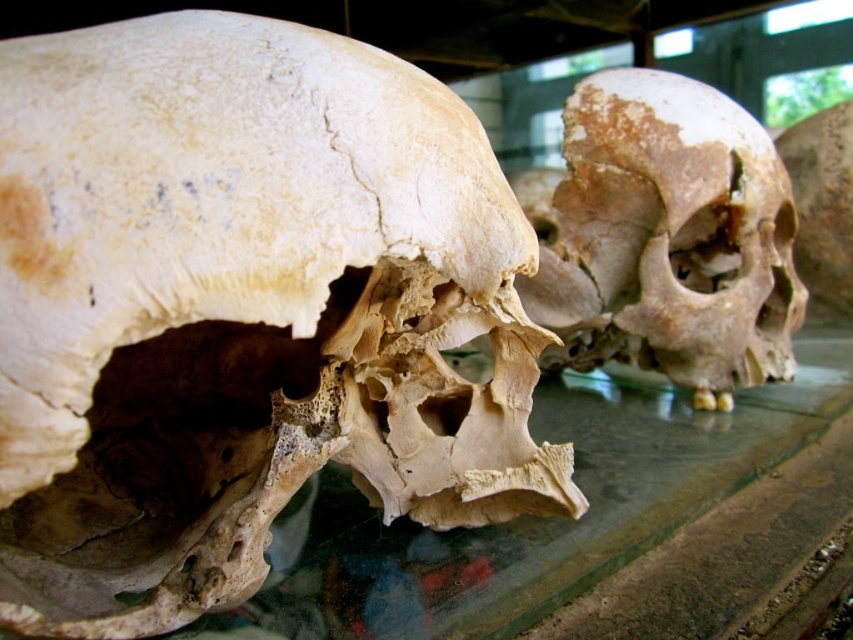
From the picture: You are a visitor at a museum exhibit displaying two human skulls on a table. You notice a point labeled as point (534,516). Based on the description, what object is located at this point?

The point (534,516) indicates the location of the transparent glass table at center.